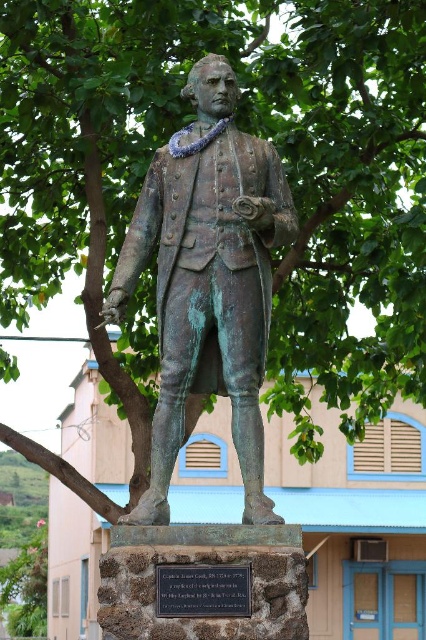
Question: Is green patina statue at center positioned in front of black stone plaque at center?

Choices:
 (A) yes
 (B) no

Answer: (B)

Question: Does green patina statue at center have a greater width compared to black stone plaque at center?

Choices:
 (A) no
 (B) yes

Answer: (B)

Question: Can you confirm if green patina statue at center is smaller than black stone plaque at center?

Choices:
 (A) yes
 (B) no

Answer: (B)